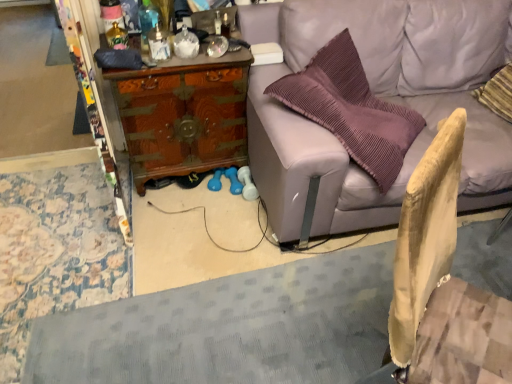
I want to click on free spot in front of wooden chest at center, so click(194, 223).